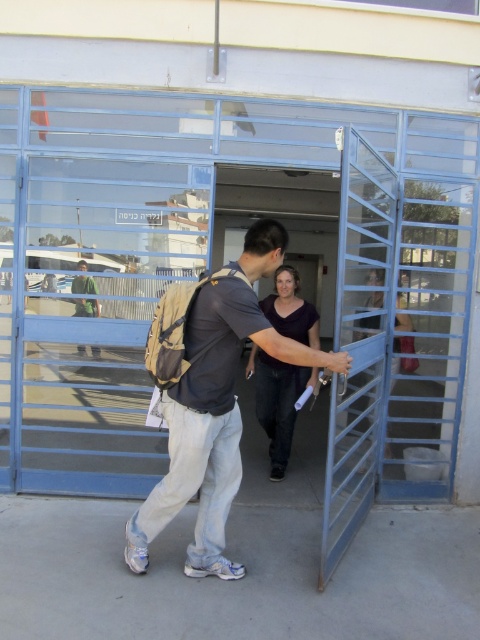
Who is higher up, blue metallic gate at center or transparent glass door at center?

transparent glass door at center

In the scene shown: Is blue metallic gate at center shorter than transparent glass door at center?

Yes, blue metallic gate at center is shorter than transparent glass door at center.

From the picture: Who is more forward, (x=155, y=170) or (x=26, y=298)?

Point (x=155, y=170) is in front.

Identify the location of blue metallic gate at center. Image resolution: width=480 pixels, height=640 pixels. (199, 262).

Is khaki fabric backpack at center below dark purple shirt at center?

Correct, khaki fabric backpack at center is located below dark purple shirt at center.

What do you see at coordinates (211, 424) in the screenshot? This screenshot has height=640, width=480. I see `khaki fabric backpack at center` at bounding box center [211, 424].

What do you see at coordinates (211, 424) in the screenshot? I see `khaki fabric backpack at center` at bounding box center [211, 424].

Locate an element on the screen. khaki fabric backpack at center is located at coordinates (211, 424).

Who is positioned more to the left, transparent glass door at center or dark purple shirt at center?

Positioned to the left is transparent glass door at center.

Between transparent glass door at center and dark purple shirt at center, which one is positioned lower?

Positioned lower is dark purple shirt at center.

Between point (147, 184) and point (280, 410), which one is positioned behind?

The point (280, 410) is behind.

Where is `transparent glass door at center`? This screenshot has height=640, width=480. transparent glass door at center is located at coordinates (96, 316).